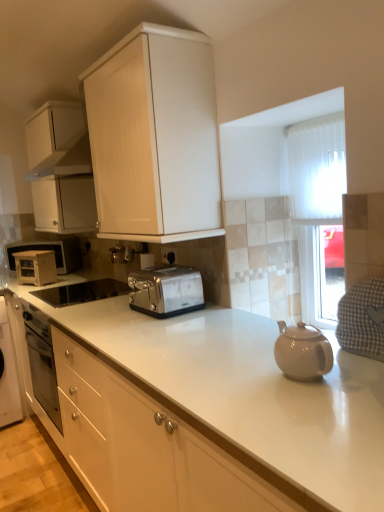
The height and width of the screenshot is (512, 384). Describe the element at coordinates (61, 169) in the screenshot. I see `white matte cabinet at upper left, placed as the second cabinetry when sorted from right to left` at that location.

The height and width of the screenshot is (512, 384). What are the coordinates of `gray checkered cloth at right` in the screenshot? It's located at (362, 319).

What do you see at coordinates (155, 135) in the screenshot? I see `white glossy cabinet at upper center, positioned as the 1th cabinetry in front-to-back order` at bounding box center [155, 135].

You are a GUI agent. You are given a task and a screenshot of the screen. Output one action in this format:
    pyautogui.click(x=<x>, y=<y>)
    Task: Click on the white glossy cabinet at upper center, which is the second cabinetry in left-to-right order
    This screenshot has height=512, width=384.
    Given the screenshot: What is the action you would take?
    pyautogui.click(x=155, y=135)

You are a GUI agent. You are given a task and a screenshot of the screen. Output one action in this format:
    pyautogui.click(x=<x>, y=<y>)
    Task: Click on the satin silver toaster at center, acting as the 3th appliance starting from the back
    The width and height of the screenshot is (384, 512).
    Given the screenshot: What is the action you would take?
    pyautogui.click(x=82, y=292)

What is the approximate width of satin silver toaster at center, which ranks as the 1th appliance in front-to-back order?

satin silver toaster at center, which ranks as the 1th appliance in front-to-back order, is 21.67 inches wide.

This screenshot has height=512, width=384. In order to click on satin silver toaster at left, which is counted as the second appliance, starting from the front in this screenshot , I will do `click(35, 267)`.

Does point (121, 281) appear closer or farther from the camera than point (187, 196)?

Point (121, 281) is positioned farther from the camera compared to point (187, 196).

Is satin silver toaster at center, acting as the 3th appliance starting from the back, not close to white glossy cabinet at upper center, positioned as the 2th cabinetry in back-to-front order?

Yes, satin silver toaster at center, acting as the 3th appliance starting from the back, and white glossy cabinet at upper center, positioned as the 2th cabinetry in back-to-front order, are located far from each other.

From the image's perspective, is satin silver toaster at center, which ranks as the 1th appliance in front-to-back order, located above or below white glossy cabinet at upper center, positioned as the 1th cabinetry in front-to-back order?

satin silver toaster at center, which ranks as the 1th appliance in front-to-back order, is below white glossy cabinet at upper center, positioned as the 1th cabinetry in front-to-back order.

Starting from the white glossy cabinet at upper center, acting as the first cabinetry starting from the right, which appliance is the 1st one behind? Please provide its 2D coordinates.

[(82, 292)]

Who is smaller, gray checkered cloth at right or white matte cabinet at upper left, the 1th cabinetry in the back-to-front sequence?

gray checkered cloth at right is smaller.

Is gray checkered cloth at right next to white matte cabinet at upper left, which is the 1th cabinetry from left to right?

There is a gap between gray checkered cloth at right and white matte cabinet at upper left, which is the 1th cabinetry from left to right.

Considering the sizes of objects gray checkered cloth at right and white matte cabinet at upper left, the 1th cabinetry in the back-to-front sequence, in the image provided, who is thinner, gray checkered cloth at right or white matte cabinet at upper left, the 1th cabinetry in the back-to-front sequence,?

gray checkered cloth at right is thinner.

Which of these two, gray checkered cloth at right or white matte cabinet at upper left, placed as the second cabinetry when sorted from right to left, stands shorter?

gray checkered cloth at right.

Is white matte cabinet at upper left, placed as the second cabinetry when sorted from right to left, wider or thinner than gray checkered cloth at right?

In the image, white matte cabinet at upper left, placed as the second cabinetry when sorted from right to left, appears to be wider than gray checkered cloth at right.

Is white matte cabinet at upper left, the 2th cabinetry from the front, not near gray checkered cloth at right?

Yes, white matte cabinet at upper left, the 2th cabinetry from the front, is far from gray checkered cloth at right.

Who is taller, white matte cabinet at upper left, which is the 1th cabinetry from left to right, or gray checkered cloth at right?

With more height is white matte cabinet at upper left, which is the 1th cabinetry from left to right.

Is point (52, 204) in front of point (357, 321)?

No.

From the image's perspective, which one is positioned lower, satin silver toaster at left, which is counted as the second appliance, starting from the front, or satin silver toaster at center?

satin silver toaster at center is shown below in the image.

Who is more distant, satin silver toaster at left, which ranks as the second appliance in back-to-front order, or satin silver toaster at center?

Positioned behind is satin silver toaster at left, which ranks as the second appliance in back-to-front order.

In the scene shown: Does satin silver toaster at left, which ranks as the second appliance in back-to-front order, turn towards satin silver toaster at center?

No, satin silver toaster at left, which ranks as the second appliance in back-to-front order, is not turned towards satin silver toaster at center.

Which object is positioned more to the left, satin silver toaster at left, which ranks as the second appliance in back-to-front order, or satin silver toaster at center?

satin silver toaster at left, which ranks as the second appliance in back-to-front order, is more to the left.

From a real-world perspective, which is physically below, gray checkered cloth at right or satin silver toaster at center, acting as the 3th appliance starting from the back?

satin silver toaster at center, acting as the 3th appliance starting from the back, from a real-world perspective.

From the image's perspective, is gray checkered cloth at right under satin silver toaster at center, acting as the 3th appliance starting from the back?

No, from the image's perspective, gray checkered cloth at right is not beneath satin silver toaster at center, acting as the 3th appliance starting from the back.

Does gray checkered cloth at right have a lesser width compared to satin silver toaster at center, acting as the 3th appliance starting from the back?

Yes, gray checkered cloth at right is thinner than satin silver toaster at center, acting as the 3th appliance starting from the back.

Is gray checkered cloth at right aimed at satin silver toaster at center, acting as the 3th appliance starting from the back?

No, gray checkered cloth at right is not oriented towards satin silver toaster at center, acting as the 3th appliance starting from the back.

Does white matte microwave at left, which appears as the third appliance when viewed from the front, have a greater width compared to satin silver toaster at left, which ranks as the second appliance in back-to-front order?

Correct, the width of white matte microwave at left, which appears as the third appliance when viewed from the front, exceeds that of satin silver toaster at left, which ranks as the second appliance in back-to-front order.

Between point (56, 256) and point (23, 280), which one is positioned in front?

The point (23, 280) is closer to the camera.

Considering the positions of objects white matte microwave at left, which appears as the third appliance when viewed from the front, and satin silver toaster at left, which ranks as the second appliance in back-to-front order, in the image provided, who is more to the right, white matte microwave at left, which appears as the third appliance when viewed from the front, or satin silver toaster at left, which ranks as the second appliance in back-to-front order,?

Positioned to the right is satin silver toaster at left, which ranks as the second appliance in back-to-front order.

How different are the orientations of gray checkered cloth at right and satin silver toaster at center in degrees?

The facing directions of gray checkered cloth at right and satin silver toaster at center are 0.367 degrees apart.

Looking at this image, which of these two, gray checkered cloth at right or satin silver toaster at center, is smaller?

Smaller between the two is gray checkered cloth at right.

Between gray checkered cloth at right and satin silver toaster at center, which one has smaller width?

gray checkered cloth at right.

Locate an element on the screen. This screenshot has width=384, height=512. the 1st cabinetry above the satin silver toaster at center, acting as the 3th appliance starting from the back (from the image's perspective) is located at coordinates (155, 135).

The image size is (384, 512). In order to click on gray in front of the white matte cabinet at upper left, which is the 1th cabinetry from left to right in this screenshot , I will do `click(362, 319)`.

Estimate the real-world distances between objects in this image. Which object is further from satin silver toaster at center, which ranks as the 1th appliance in front-to-back order, white matte cabinet at upper left, the 2th cabinetry from the front, or white glossy cabinet at upper center, positioned as the 2th cabinetry in back-to-front order?

white glossy cabinet at upper center, positioned as the 2th cabinetry in back-to-front order, is further to satin silver toaster at center, which ranks as the 1th appliance in front-to-back order.

Looking at the image, which one is located closer to white glossy cabinet at upper center, positioned as the 2th cabinetry in back-to-front order, white matte cabinet at upper left, the 2th cabinetry from the front, or satin silver toaster at center, which ranks as the 1th appliance in front-to-back order?

white matte cabinet at upper left, the 2th cabinetry from the front, lies closer to white glossy cabinet at upper center, positioned as the 2th cabinetry in back-to-front order, than the other object.

When comparing their distances from white matte microwave at left, which appears as the third appliance when viewed from the front, does satin silver toaster at center, acting as the 3th appliance starting from the back, or white glossy cabinet at upper center, acting as the first cabinetry starting from the right, seem closer?

satin silver toaster at center, acting as the 3th appliance starting from the back, is positioned closer to the anchor white matte microwave at left, which appears as the third appliance when viewed from the front.

Which object lies further to the anchor point white matte microwave at left, the 1th appliance positioned from the back, satin silver toaster at left, which ranks as the second appliance in back-to-front order, or satin silver toaster at center, acting as the 3th appliance starting from the back?

Among the two, satin silver toaster at center, acting as the 3th appliance starting from the back, is located further to white matte microwave at left, the 1th appliance positioned from the back.

Which object lies nearer to the anchor point white matte cabinet at upper left, the 1th cabinetry in the back-to-front sequence, satin silver toaster at center, acting as the 3th appliance starting from the back, or gray checkered cloth at right?

Among the two, satin silver toaster at center, acting as the 3th appliance starting from the back, is located nearer to white matte cabinet at upper left, the 1th cabinetry in the back-to-front sequence.

Based on their spatial positions, is white glossy cabinet at upper center, positioned as the 2th cabinetry in back-to-front order, or gray checkered cloth at right closer to white matte microwave at left, which appears as the third appliance when viewed from the front?

Among the two, white glossy cabinet at upper center, positioned as the 2th cabinetry in back-to-front order, is located nearer to white matte microwave at left, which appears as the third appliance when viewed from the front.

Based on their spatial positions, is white matte cabinet at upper left, which is the 1th cabinetry from left to right, or satin silver toaster at center, which ranks as the 1th appliance in front-to-back order, closer to white matte microwave at left, the 1th appliance positioned from the back?

satin silver toaster at center, which ranks as the 1th appliance in front-to-back order.

Considering their positions, is gray checkered cloth at right positioned closer to satin silver toaster at center, acting as the 3th appliance starting from the back, than white matte cabinet at upper left, which is the 1th cabinetry from left to right?

The object closer to satin silver toaster at center, acting as the 3th appliance starting from the back, is white matte cabinet at upper left, which is the 1th cabinetry from left to right.

This screenshot has width=384, height=512. Find the location of `cabinetry between white glossy cabinet at upper center, acting as the first cabinetry starting from the right, and satin silver toaster at left, which is counted as the second appliance, starting from the front, along the z-axis`. cabinetry between white glossy cabinet at upper center, acting as the first cabinetry starting from the right, and satin silver toaster at left, which is counted as the second appliance, starting from the front, along the z-axis is located at coordinates (61, 169).

Where is `appliance between gray checkered cloth at right and satin silver toaster at left, which is counted as the second appliance, starting from the front, from front to back`? appliance between gray checkered cloth at right and satin silver toaster at left, which is counted as the second appliance, starting from the front, from front to back is located at coordinates (82, 292).

The width and height of the screenshot is (384, 512). What are the coordinates of `cabinetry between satin silver toaster at center, acting as the 3th appliance starting from the back, and white matte microwave at left, which appears as the third appliance when viewed from the front, in the front-back direction` in the screenshot? It's located at (61, 169).

This screenshot has height=512, width=384. What are the coordinates of `appliance between satin silver toaster at center and satin silver toaster at left, which is counted as the second appliance, starting from the front, in the front-back direction` in the screenshot? It's located at (82, 292).